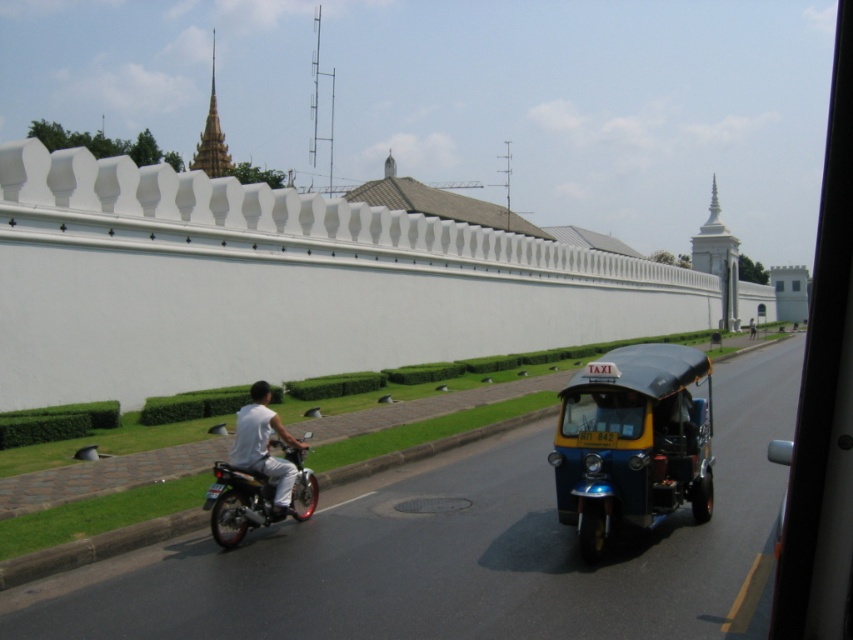
You are standing at the point with coordinates (631,442) in the city street scene. What object is located exactly at your current position?

The blue metallic tuk tuk at center is located exactly at the point (631,442).